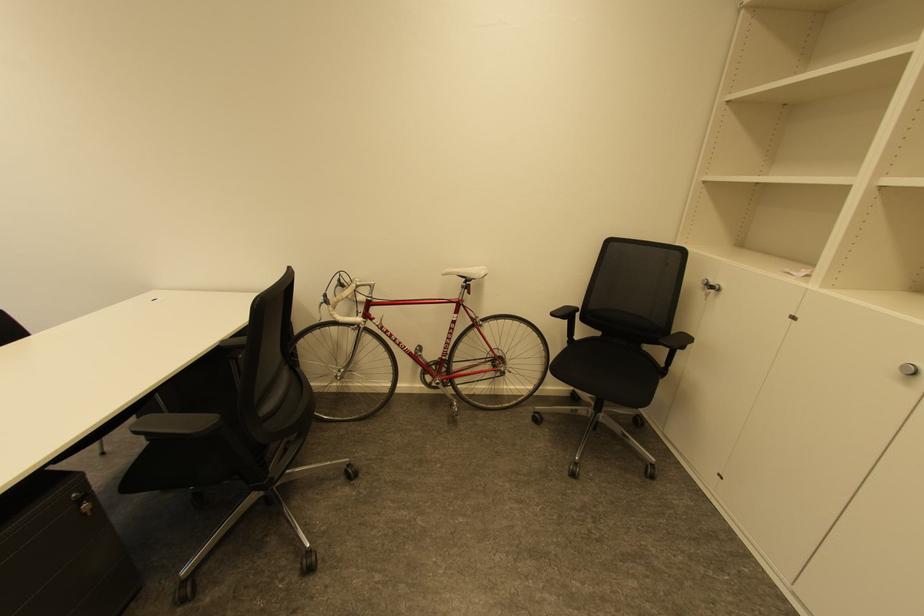
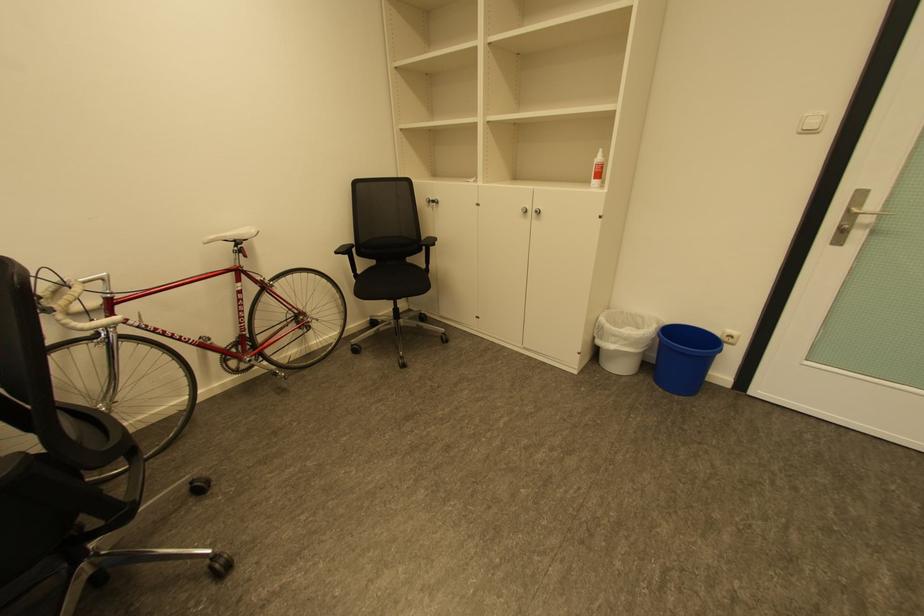
In the second image, find the point that corresponds to point (338, 315) in the first image.

(70, 326)